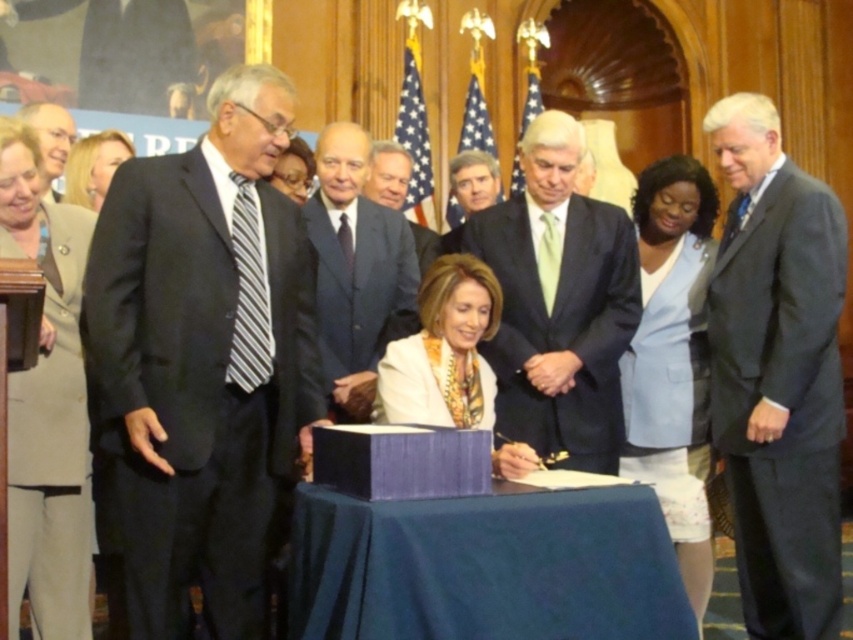
You are standing in the room where the signing ceremony is taking place. There are two points marked in the scene, one at coordinates point (x=546, y=227) and another at point (x=10, y=548). If you were to walk towards both points, which point would you reach first?

You would reach point (x=10, y=548) first because it is closer to you than point (x=546, y=227), which is further away.

You are attending a formal event and need to locate two people based on their attire. There is a person wearing a dark gray suit at right and another in a light blue suit at center. Which one is closer to the signing table?

The light blue suit at center is closer to the signing table because the dark gray suit at right is positioned over it, meaning the dark gray suit is further away.